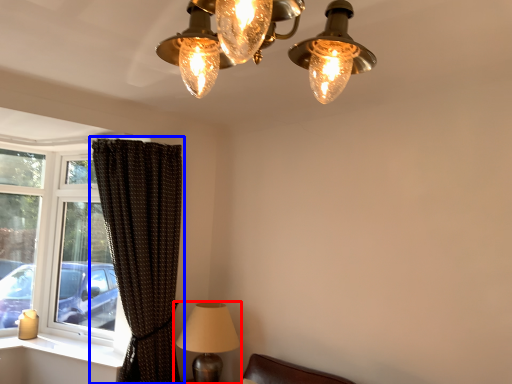
Question: Which object appears closest to the camera in this image, lamp (highlighted by a red box) or curtain (highlighted by a blue box)?

Choices:
 (A) lamp
 (B) curtain

Answer: (B)